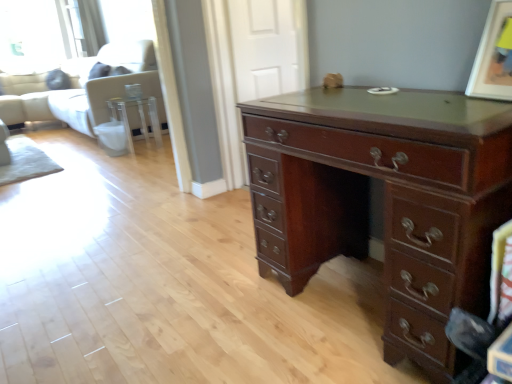
Question: Visually, is white fabric couch at upper left positioned to the left or to the right of matte brown picture frame at upper right?

Choices:
 (A) left
 (B) right

Answer: (A)

Question: From the image's perspective, is white fabric couch at upper left above or below matte brown picture frame at upper right?

Choices:
 (A) below
 (B) above

Answer: (B)

Question: Which object is positioned closest to the white fabric couch at upper left?

Choices:
 (A) mahogany wood desk at center
 (B) matte brown picture frame at upper right
 (C) clear glass side table at center

Answer: (C)

Question: Which object is the closest to the white fabric couch at upper left?

Choices:
 (A) mahogany wood desk at center
 (B) matte brown picture frame at upper right
 (C) clear glass side table at center

Answer: (C)